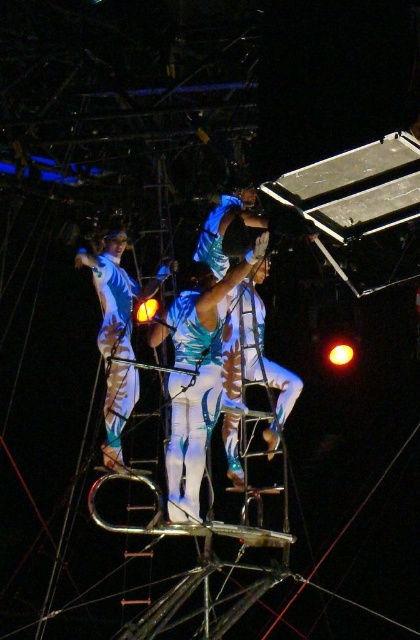
Who is positioned more to the left, shiny teal fabric at center or white glossy leotard at upper center?

From the viewer's perspective, white glossy leotard at upper center appears more on the left side.

Locate an element on the screen. The height and width of the screenshot is (640, 420). shiny teal fabric at center is located at coordinates (251, 371).

Which is more to the left, shiny metallic costume at center or shiny teal fabric at center?

shiny metallic costume at center

This screenshot has height=640, width=420. What do you see at coordinates (196, 380) in the screenshot?
I see `shiny metallic costume at center` at bounding box center [196, 380].

Between point (207, 364) and point (228, 365), which one is positioned behind?

The point (228, 365) is more distant.

Find the location of a particular element. This screenshot has width=420, height=640. shiny metallic costume at center is located at coordinates (196, 380).

Does shiny metallic costume at center come behind white glossy leotard at upper center?

No, it is not.

Who is more forward, (199,438) or (172,272)?

Point (199,438)

The width and height of the screenshot is (420, 640). In order to click on shiny metallic costume at center in this screenshot , I will do `click(196, 380)`.